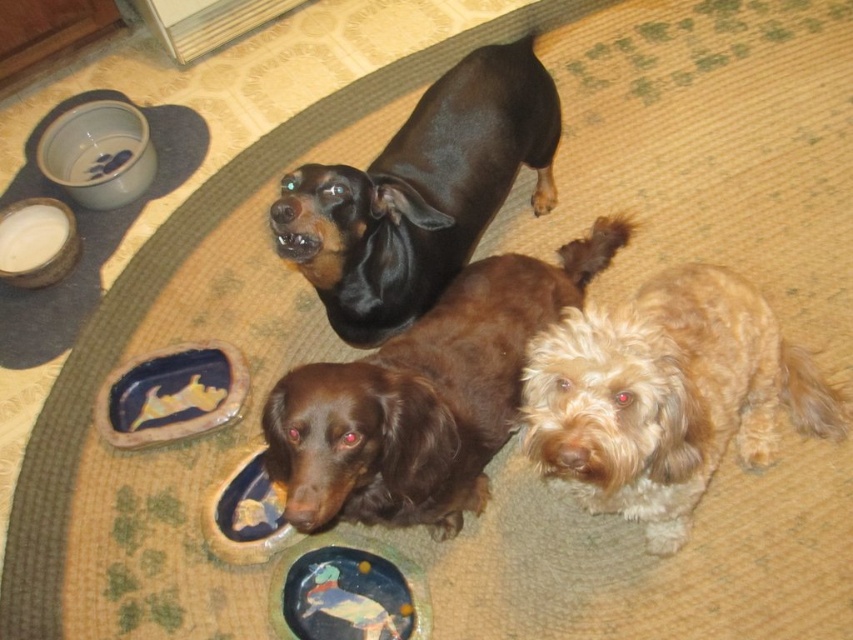
At what (x,y) coordinates should I click in order to perform the action: click on fuzzy light brown dog at lower right. Please return your answer as a coordinate pair (x, y). The width and height of the screenshot is (853, 640). Looking at the image, I should click on (665, 396).

I want to click on fuzzy light brown dog at lower right, so click(x=665, y=396).

Can you confirm if fuzzy light brown dog at lower right is wider than matte ceramic platter at center?

Correct, the width of fuzzy light brown dog at lower right exceeds that of matte ceramic platter at center.

Is point (674, 317) in front of point (181, 403)?

Yes, point (674, 317) is in front of point (181, 403).

The height and width of the screenshot is (640, 853). Find the location of `fuzzy light brown dog at lower right`. fuzzy light brown dog at lower right is located at coordinates (665, 396).

The height and width of the screenshot is (640, 853). What do you see at coordinates (421, 193) in the screenshot? I see `black shiny coat at upper center` at bounding box center [421, 193].

Which is in front, point (457, 189) or point (331, 637)?

Point (331, 637)

Locate an element on the screen. The image size is (853, 640). black shiny coat at upper center is located at coordinates (421, 193).